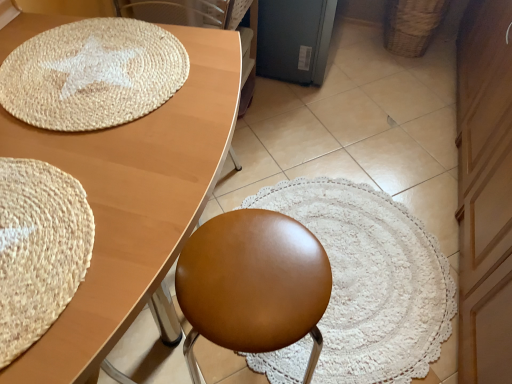
Where is `vacant space situated above matte wood table at upper left (from a real-world perspective)`? The height and width of the screenshot is (384, 512). vacant space situated above matte wood table at upper left (from a real-world perspective) is located at coordinates (87, 136).